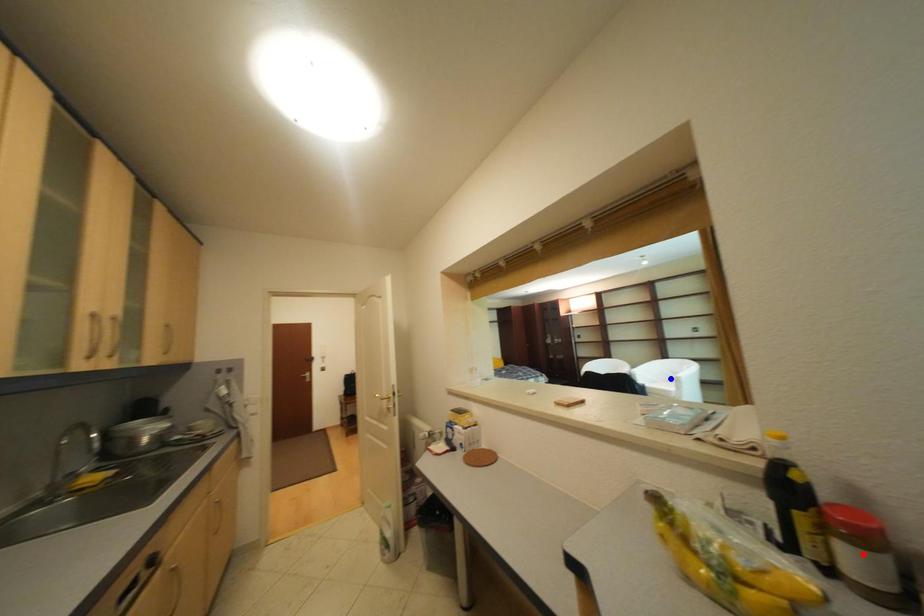
Question: In the image, two points are highlighted. Which point is nearer to the camera? Reply with the corresponding letter.

Choices:
 (A) blue point
 (B) red point

Answer: (B)